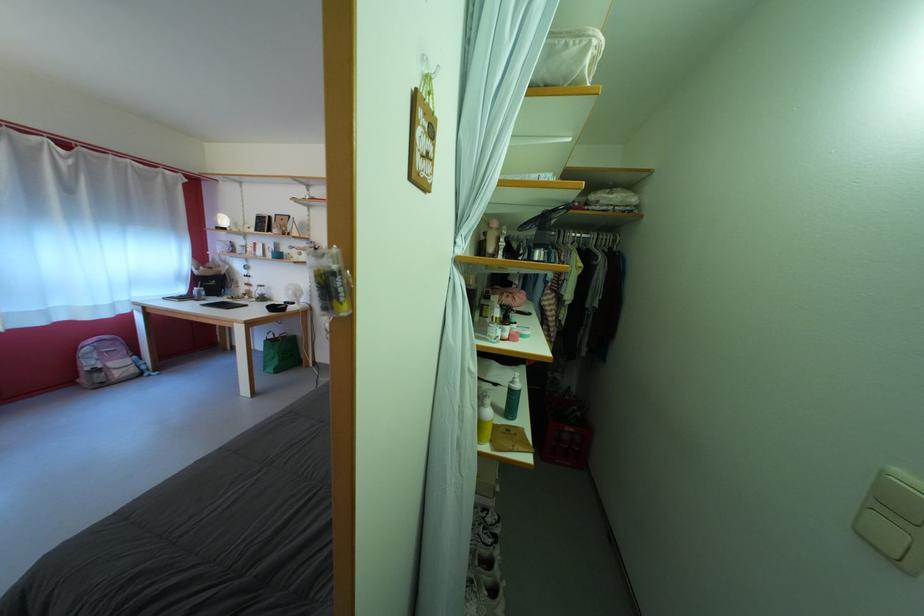
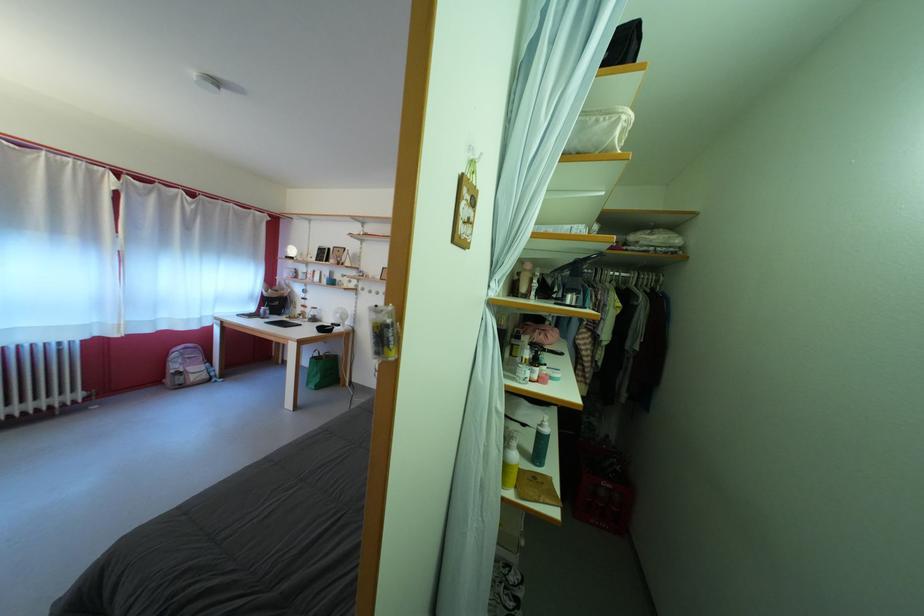
Locate, in the second image, the point that corresponds to point 575,52 in the first image.

(605, 128)